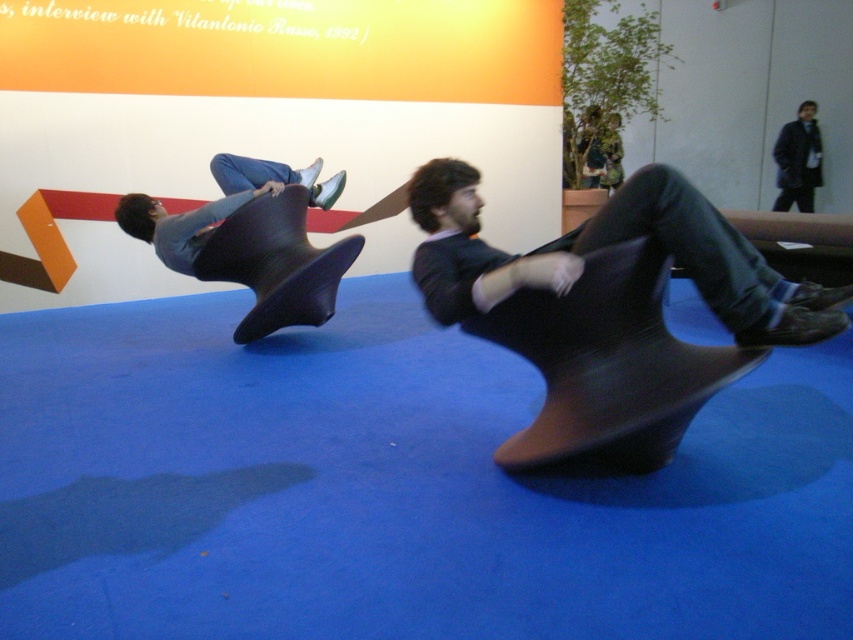
Does matte black chair at center appear over matte black chair at left?

No, matte black chair at center is not above matte black chair at left.

Does point (747, 316) come behind point (305, 227)?

No.

Find the location of a particular element. Image resolution: width=853 pixels, height=640 pixels. matte black chair at center is located at coordinates (607, 244).